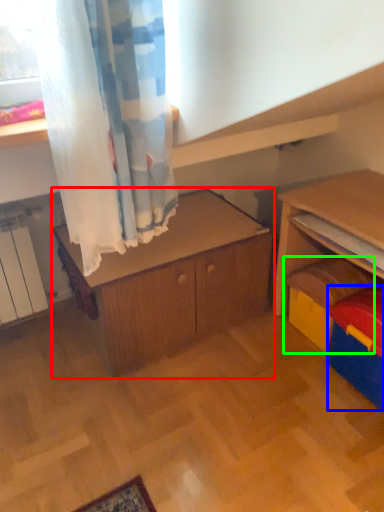
Question: Estimate the real-world distances between objects in this image. Which object is closer to cabinetry (highlighted by a red box), storage box (highlighted by a blue box) or toy (highlighted by a green box)?

Choices:
 (A) storage box
 (B) toy

Answer: (B)